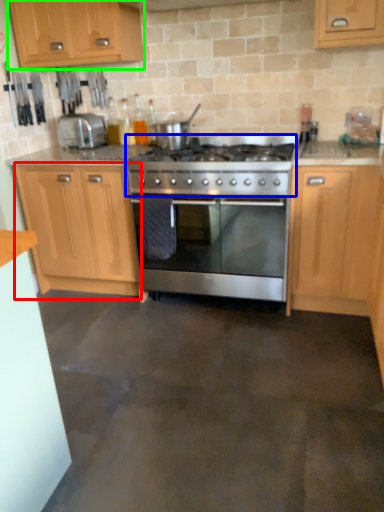
Question: Which object is positioned farthest from cabinetry (highlighted by a red box)? Select from gas stove (highlighted by a blue box) and cabinetry (highlighted by a green box).

Choices:
 (A) gas stove
 (B) cabinetry

Answer: (B)